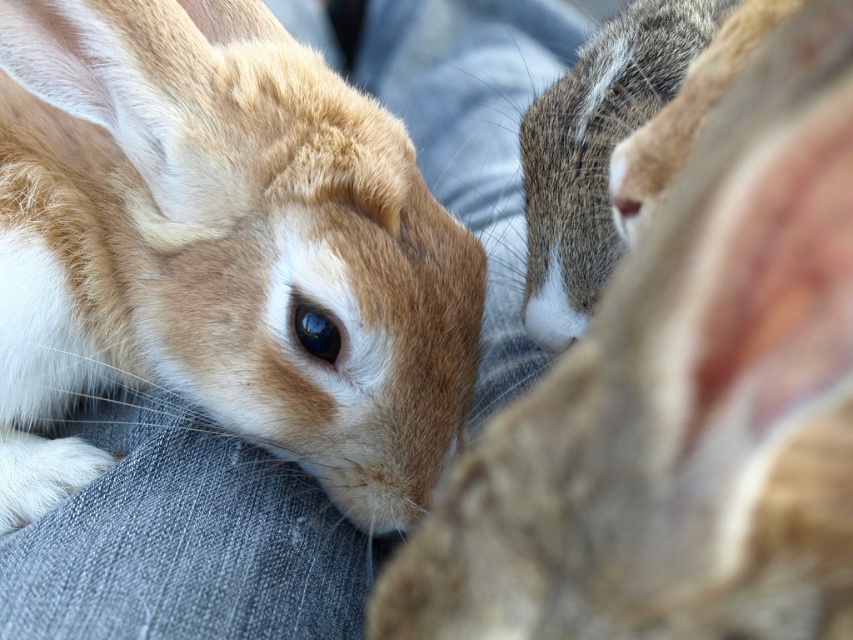
Is point (170, 225) closer to viewer compared to point (668, 212)?

No, (170, 225) is behind (668, 212).

Can you confirm if golden fur rabbit at center is taller than soft brown fur at center?

Indeed, golden fur rabbit at center has a greater height compared to soft brown fur at center.

Which is behind, point (277, 236) or point (561, 576)?

The point (277, 236) is behind.

The image size is (853, 640). Find the location of `golden fur rabbit at center`. golden fur rabbit at center is located at coordinates (221, 252).